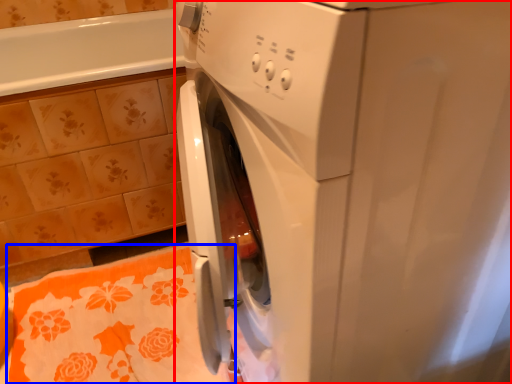
Question: Among these objects, which one is nearest to the camera, washing machine (highlighted by a red box) or bath towel (highlighted by a blue box)?

Choices:
 (A) washing machine
 (B) bath towel

Answer: (A)